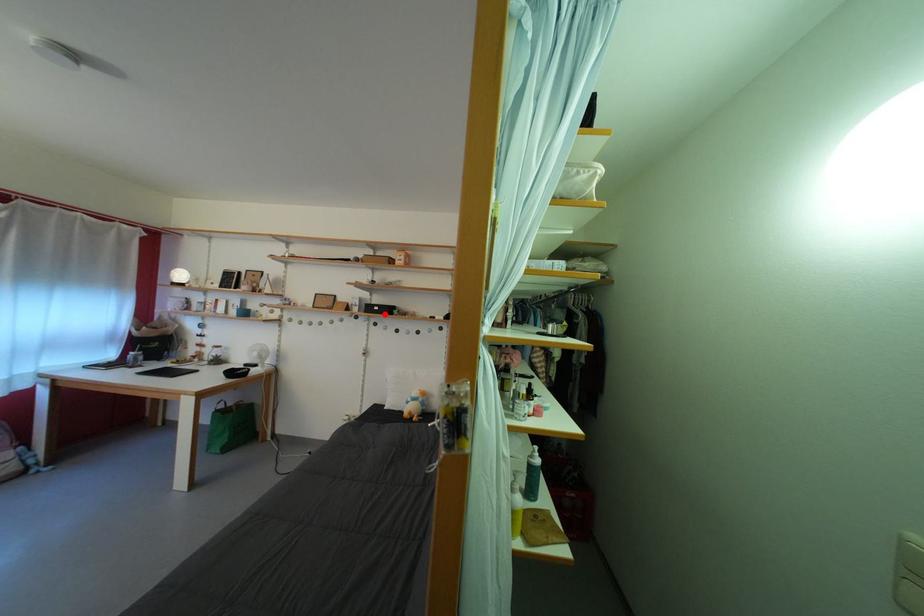
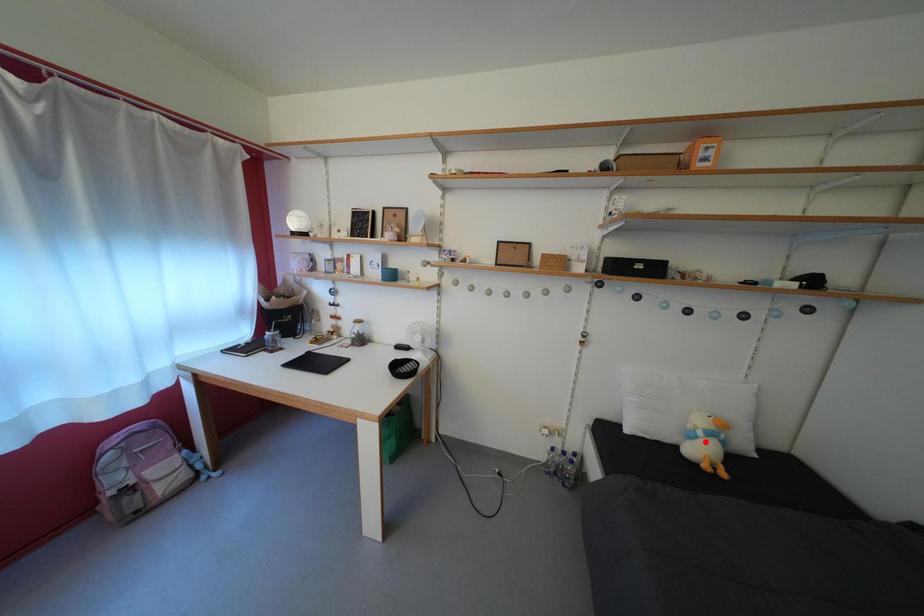
I am providing you with two images of the same scene from different viewpoints. A red point is marked on the first image and another point is marked on the second image. Does the point marked in image1 correspond to the same location as the one in image2?

No